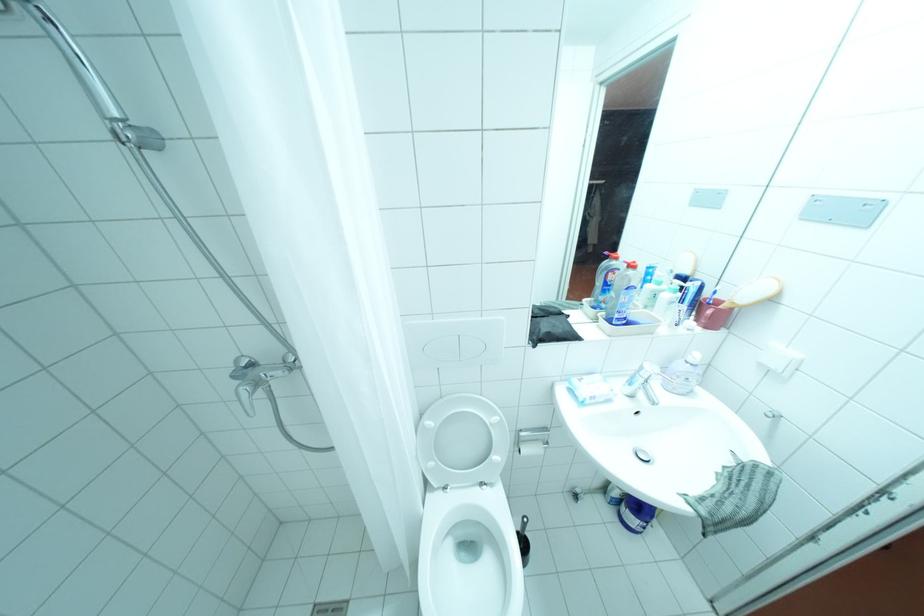
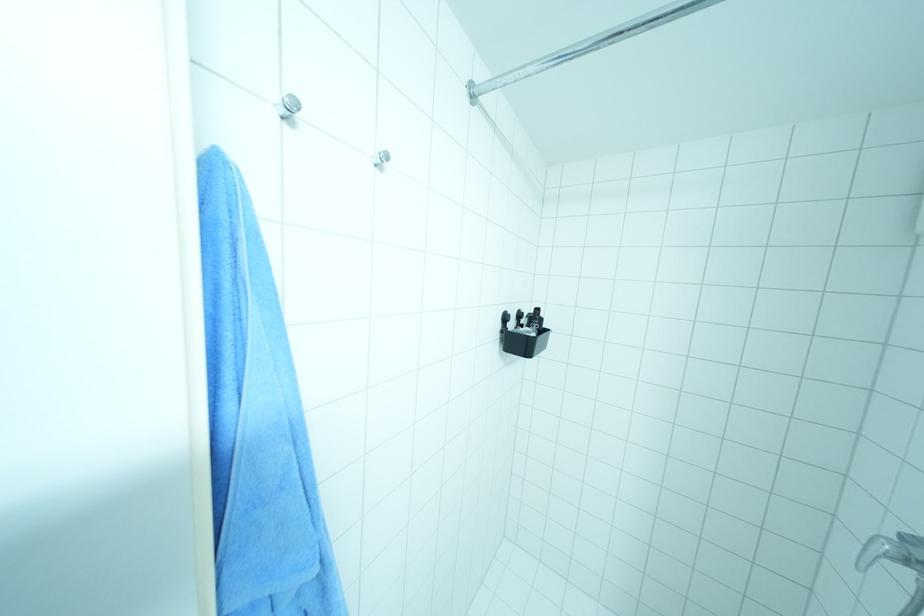
Find the pixel in the second image that matches (261,392) in the first image.

(898, 557)